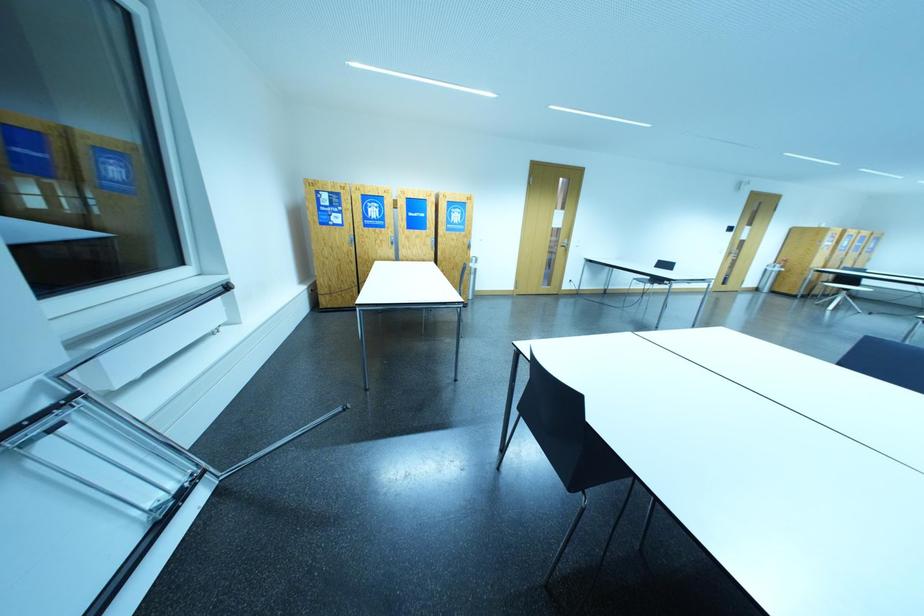
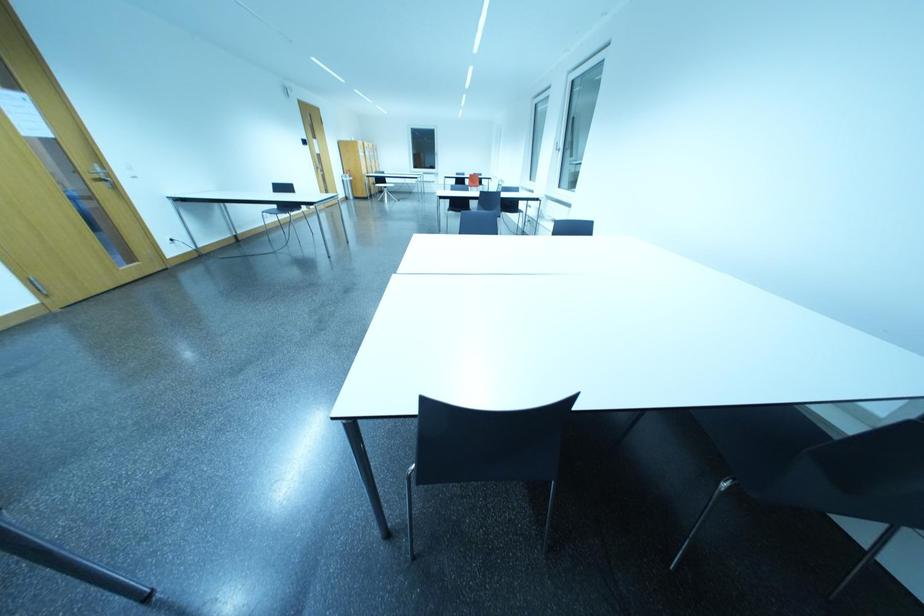
How did the camera likely rotate?

The camera's rotation is toward right-down.